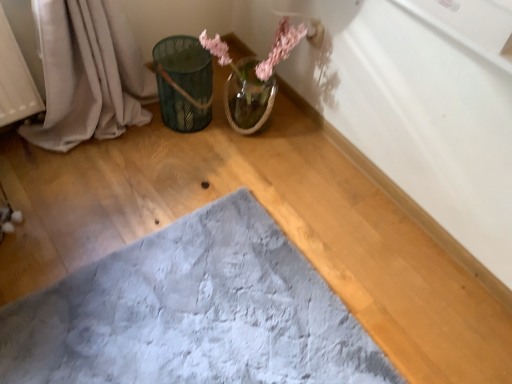
This screenshot has width=512, height=384. I want to click on vacant space that is in between translucent glass vase at upper center and green metallic bucket at upper left, so click(208, 129).